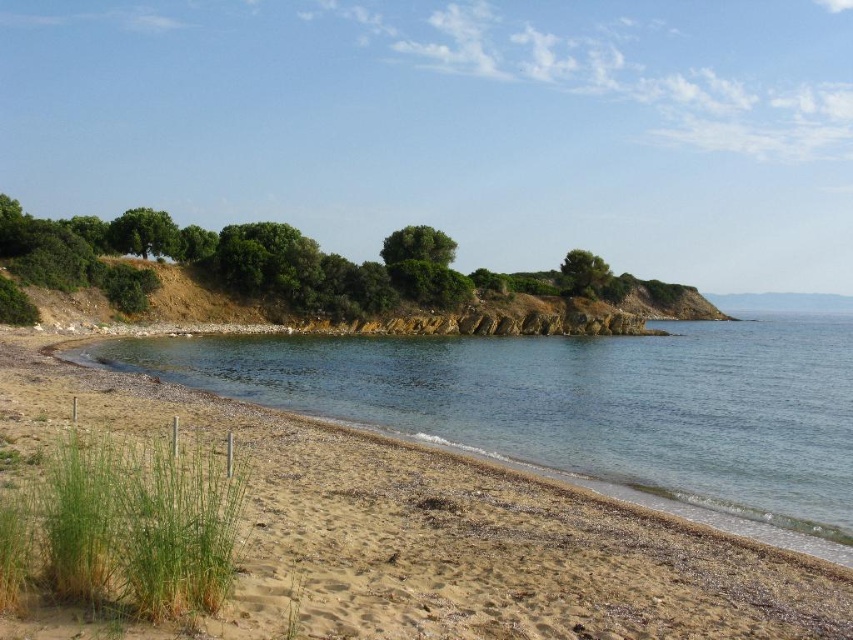
Looking at this image, you are a hiker standing on the beach and want to take a photo that includes both the clear water at lower left and the green leafy hillside at upper left. Which object will appear smaller in the photo?

The clear water at lower left will appear smaller in the photo because it has a smaller size compared to the green leafy hillside at upper left.

You are standing at the point with coordinates point (564, 326) and want to walk towards the point with coordinates point (672, 388). According to the scene, which direction should you face to move towards your destination?

Point (672, 388) is in front of point (564, 326), so you should face forward to move towards your destination.